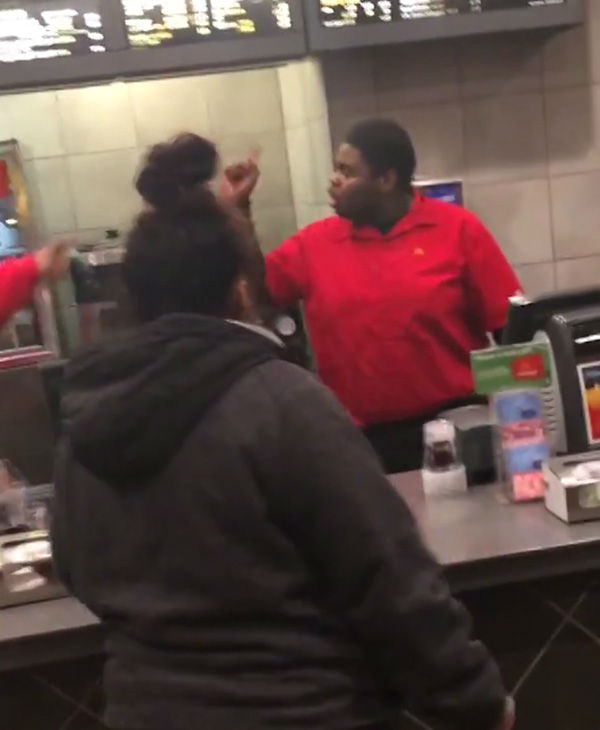
Where is `grey wall`? The height and width of the screenshot is (730, 600). grey wall is located at coordinates (240, 112), (551, 131).